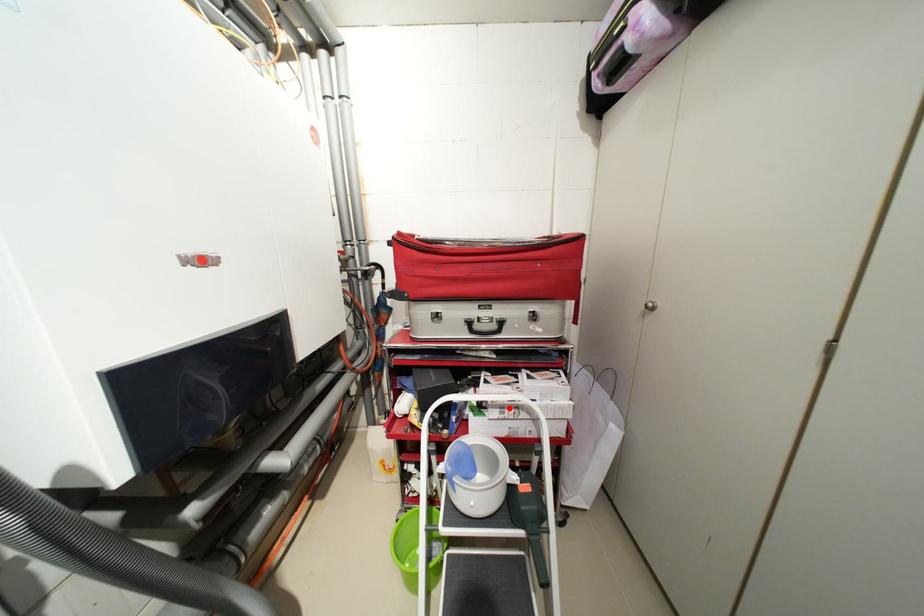
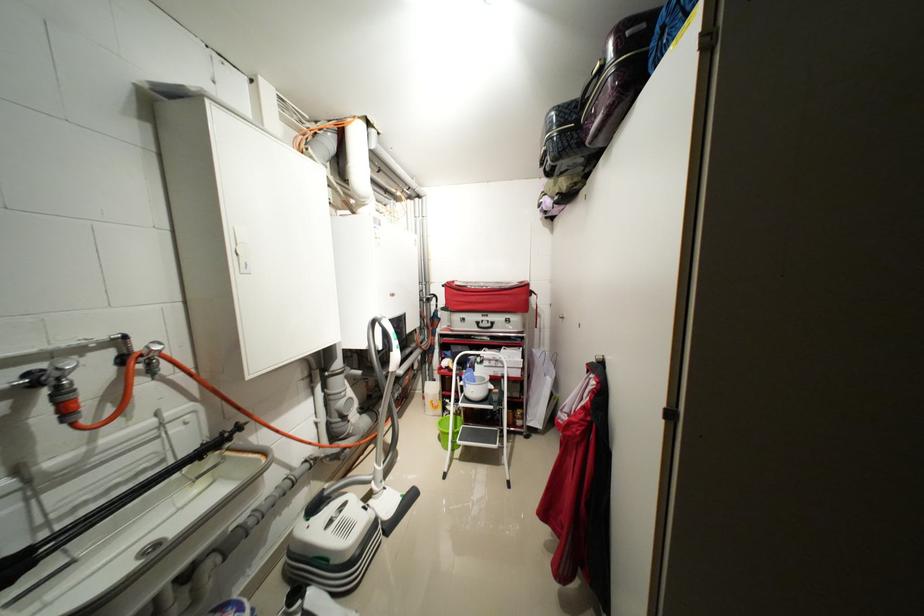
Find the pixel in the second image that matches the highlighted location in the first image.

(496, 361)